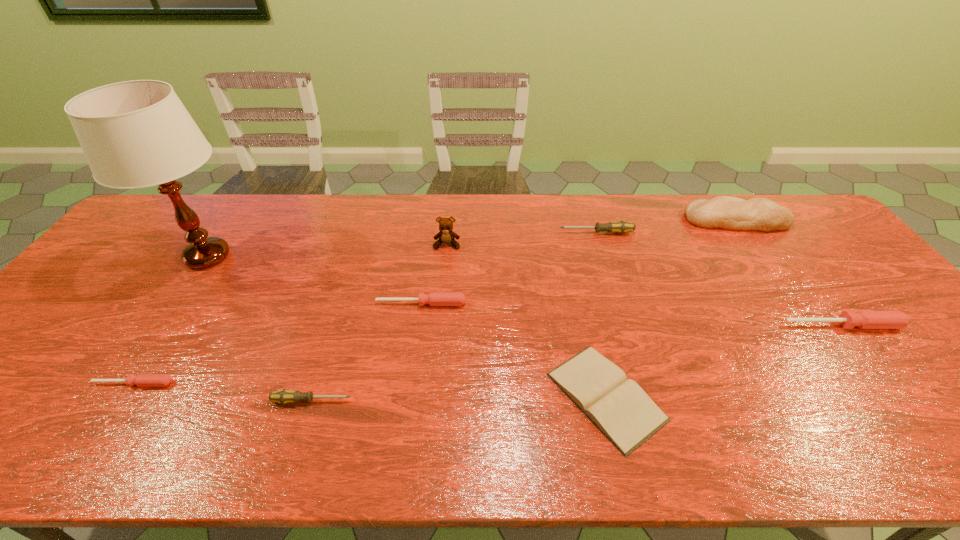
The width and height of the screenshot is (960, 540). I want to click on screwdriver that is at the far edge, so click(x=620, y=227).

The width and height of the screenshot is (960, 540). In order to click on object at the near edge in this screenshot , I will do `click(617, 406)`.

The width and height of the screenshot is (960, 540). Identify the location of object present at the left edge. (134, 134).

The height and width of the screenshot is (540, 960). I want to click on bread positioned at the right edge, so pyautogui.click(x=727, y=212).

Locate an element on the screen. screwdriver that is at the right edge is located at coordinates (861, 319).

Find the location of a particular element. object located at the far left corner is located at coordinates (134, 134).

Find the location of a particular element. The image size is (960, 540). object present at the far right corner is located at coordinates pyautogui.click(x=727, y=212).

The width and height of the screenshot is (960, 540). In the image, there is a desktop. What are the coordinates of `vacant area at the far edge` in the screenshot? It's located at (457, 223).

In the image, there is a desktop. Where is `vacant space at the near edge`? The height and width of the screenshot is (540, 960). vacant space at the near edge is located at coordinates (800, 438).

Locate an element on the screen. free location at the left edge of the desktop is located at coordinates [139, 280].